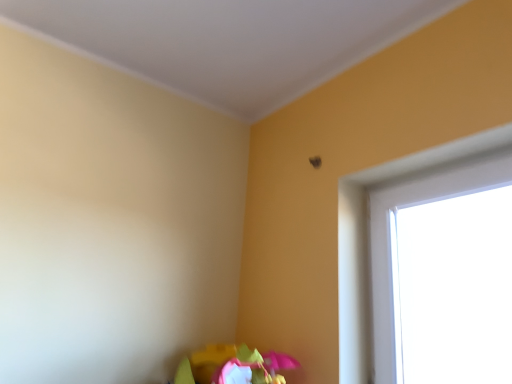
Measure the distance between point (295, 367) and camera.

The depth of point (295, 367) is 1.42 meters.

Identify the location of matte pink plastic toy at lower center. (233, 366).

Describe the element at coordinates (233, 366) in the screenshot. The width and height of the screenshot is (512, 384). I see `matte pink plastic toy at lower center` at that location.

This screenshot has height=384, width=512. What are the coordinates of `matte pink plastic toy at lower center` in the screenshot? It's located at (x=233, y=366).